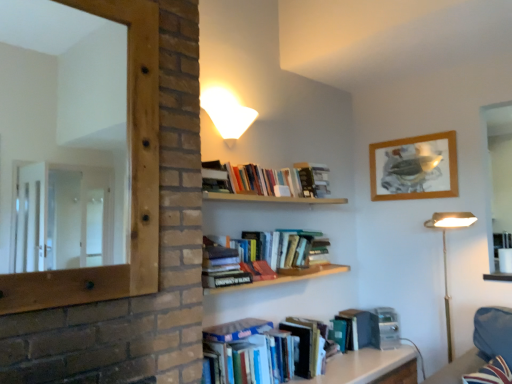
Find the location of `vacant space situated above wooden framed picture at upper right (from a real-world perspective)`. vacant space situated above wooden framed picture at upper right (from a real-world perspective) is located at coordinates pos(410,137).